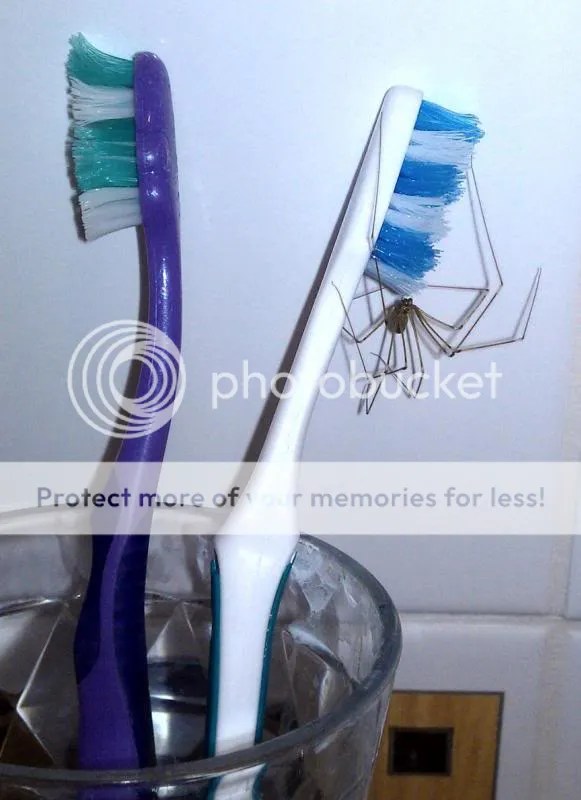
Find the location of a particular element. This screenshot has width=581, height=800. tile is located at coordinates (451, 662).